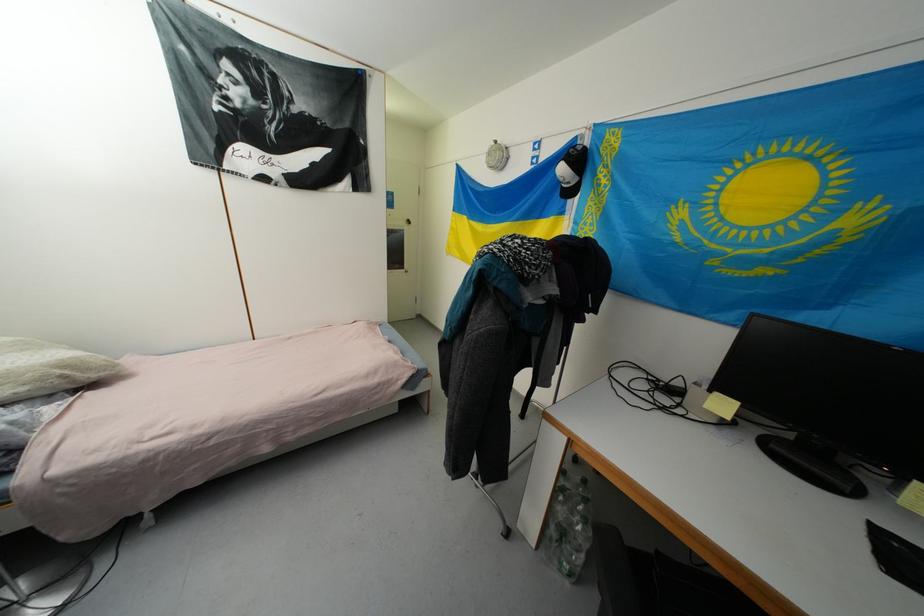
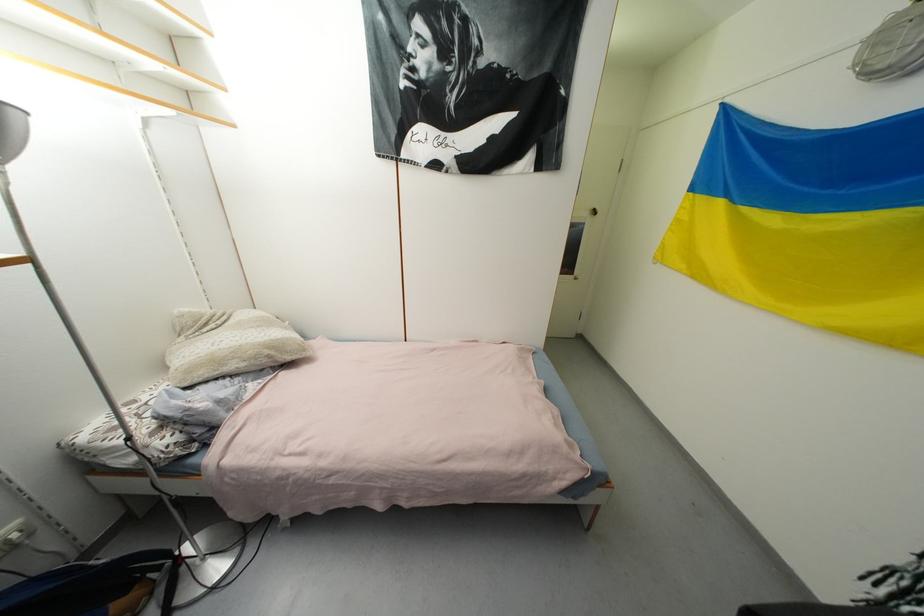
Question: The images are taken continuously from a first-person perspective. In which direction is your viewpoint rotating?

Choices:
 (A) Left
 (B) Right
 (C) Up
 (D) Down

Answer: (A)